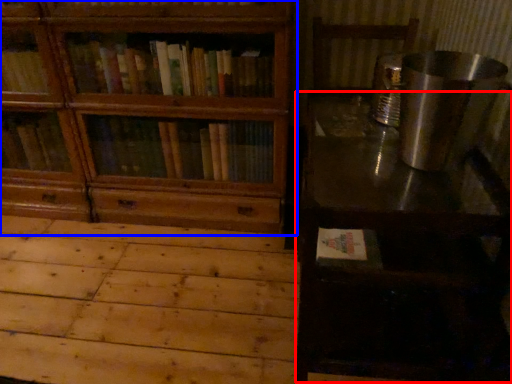
Question: Which object is further to the camera taking this photo, table (highlighted by a red box) or bookcase (highlighted by a blue box)?

Choices:
 (A) table
 (B) bookcase

Answer: (B)